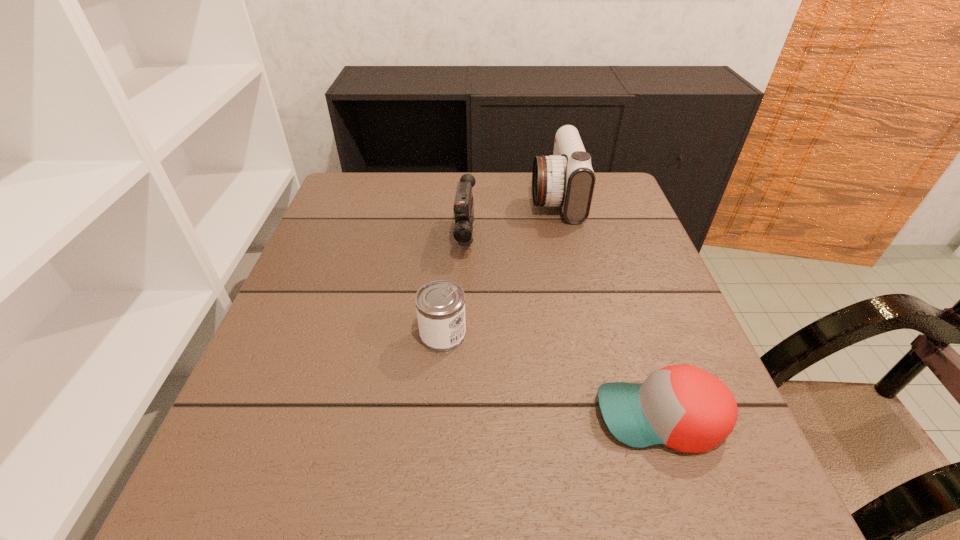
Where is `free space between the third shortest object and the taller camcorder`? The width and height of the screenshot is (960, 540). free space between the third shortest object and the taller camcorder is located at coordinates (511, 218).

Identify the location of blank region between the left camcorder and the shortest object. The width and height of the screenshot is (960, 540). click(564, 327).

This screenshot has height=540, width=960. I want to click on free space between the right camcorder and the left camcorder, so click(x=511, y=218).

The width and height of the screenshot is (960, 540). I want to click on empty space between the can and the nearest object, so click(x=552, y=376).

Point out which object is positioned as the third nearest to the shortest object. Please provide its 2D coordinates. Your answer should be formatted as a tuple, i.e. [(x, y)], where the tuple contains the x and y coordinates of a point satisfying the conditions above.

[(566, 178)]

The image size is (960, 540). I want to click on object that ranks as the third closest to the right camcorder, so click(683, 407).

Identify the location of free space that satisfies the following two spatial constraints: 1. on the surface of the right camcorder; 2. on the front-facing side of the third shortest object. (564, 238).